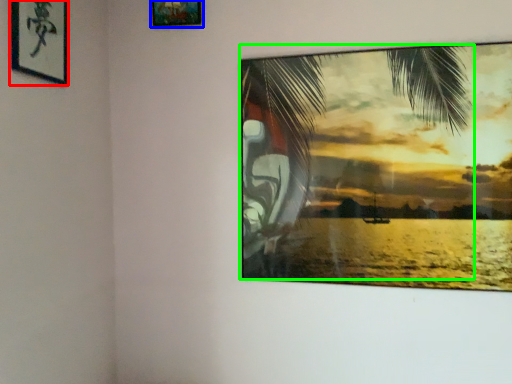
Question: Estimate the real-world distances between objects in this image. Which object is closer to picture frame (highlighted by a red box), picture frame (highlighted by a blue box) or palm tree (highlighted by a green box)?

Choices:
 (A) picture frame
 (B) palm tree

Answer: (A)